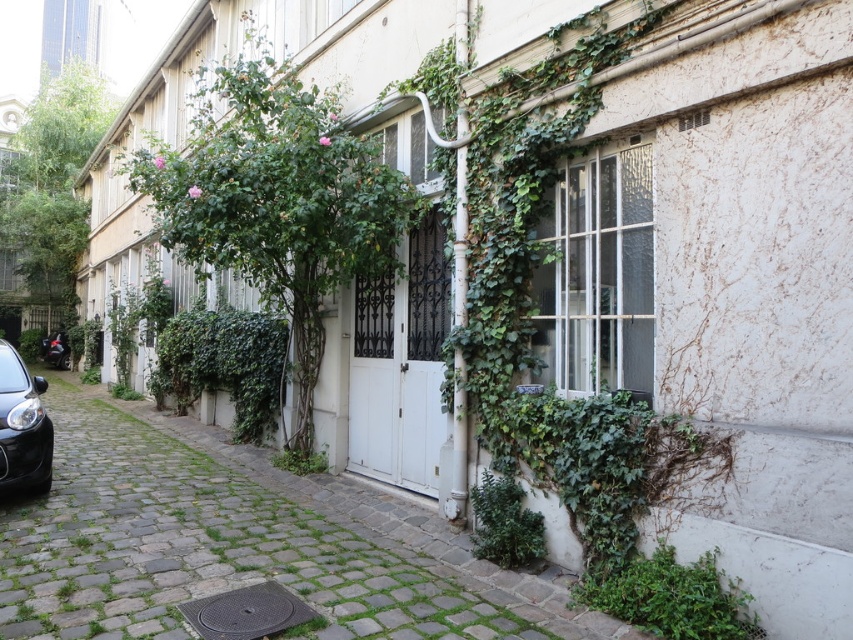
Consider the image. Can you confirm if green leafy plant at center is bigger than shiny black car at left?

Actually, green leafy plant at center might be smaller than shiny black car at left.

Who is lower down, green leafy plant at center or shiny black car at left?

green leafy plant at center is lower down.

What do you see at coordinates (300, 460) in the screenshot?
I see `green leafy plant at center` at bounding box center [300, 460].

Where is `green leafy plant at center`? The height and width of the screenshot is (640, 853). green leafy plant at center is located at coordinates (300, 460).

Does shiny black car at lower left have a greater width compared to green leafy plant at center?

Indeed, shiny black car at lower left has a greater width compared to green leafy plant at center.

Is shiny black car at lower left bigger than green leafy plant at center?

Correct, shiny black car at lower left is larger in size than green leafy plant at center.

Which is in front, point (16, 397) or point (318, 468)?

Point (16, 397) is in front.

Identify the location of shiny black car at lower left. The height and width of the screenshot is (640, 853). (22, 426).

Can you confirm if shiny black car at lower left is shorter than shiny black car at left?

Incorrect, shiny black car at lower left's height does not fall short of shiny black car at left's.

Between point (10, 353) and point (59, 333), which one is positioned in front?

Point (10, 353) is more forward.

Identify the location of shiny black car at lower left. (22, 426).